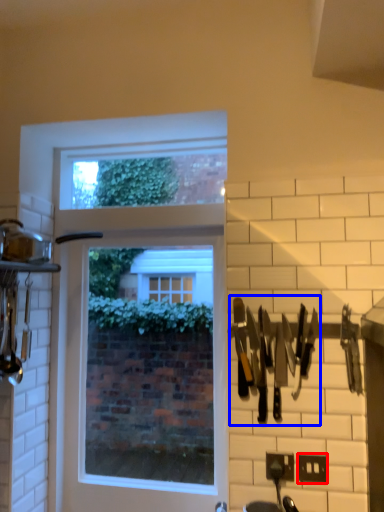
Question: Which object is closer to the camera taking this photo, electric outlet (highlighted by a red box) or cutlery (highlighted by a blue box)?

Choices:
 (A) electric outlet
 (B) cutlery

Answer: (B)